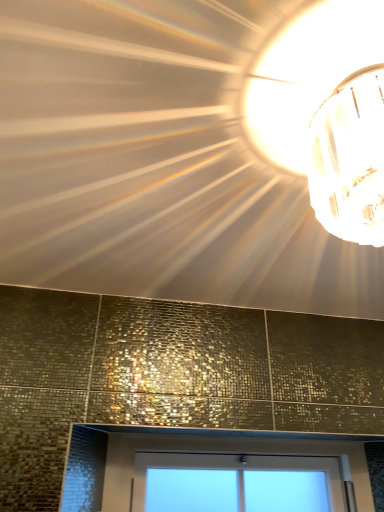
This screenshot has height=512, width=384. Describe the element at coordinates (308, 73) in the screenshot. I see `matte glass light fixture at upper right` at that location.

Identify the location of matte glass light fixture at upper right. (308, 73).

You are a GUI agent. You are given a task and a screenshot of the screen. Output one action in this format:
    pyautogui.click(x=<x>, y=<y>)
    Task: Click on the matte glass light fixture at upper right
    The image size is (384, 512).
    Given the screenshot: What is the action you would take?
    pyautogui.click(x=308, y=73)